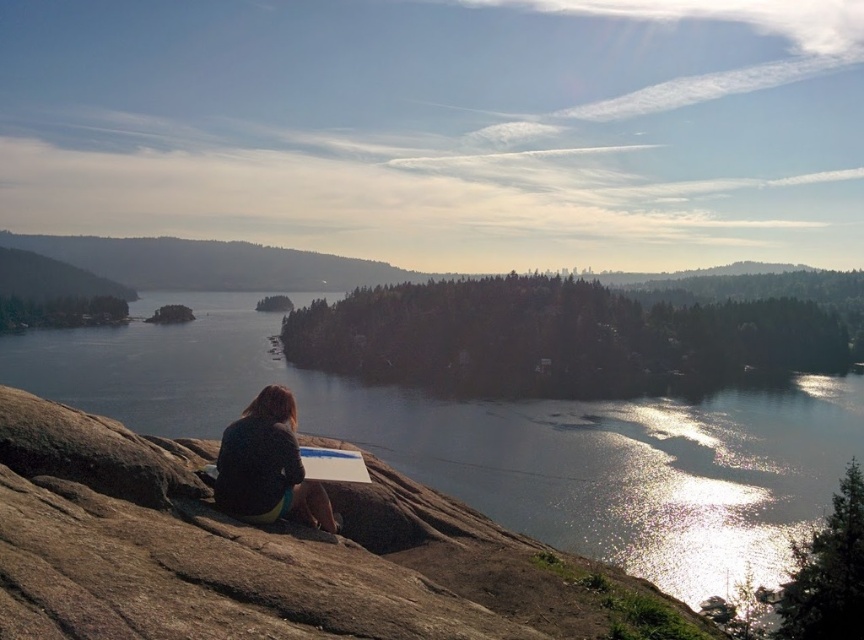
Question: Is glistening water at center in front of dark blue fabric at center?

Choices:
 (A) yes
 (B) no

Answer: (B)

Question: Does glistening water at center appear under dark blue fabric at center?

Choices:
 (A) yes
 (B) no

Answer: (A)

Question: Is glistening water at center smaller than dark blue fabric at center?

Choices:
 (A) yes
 (B) no

Answer: (B)